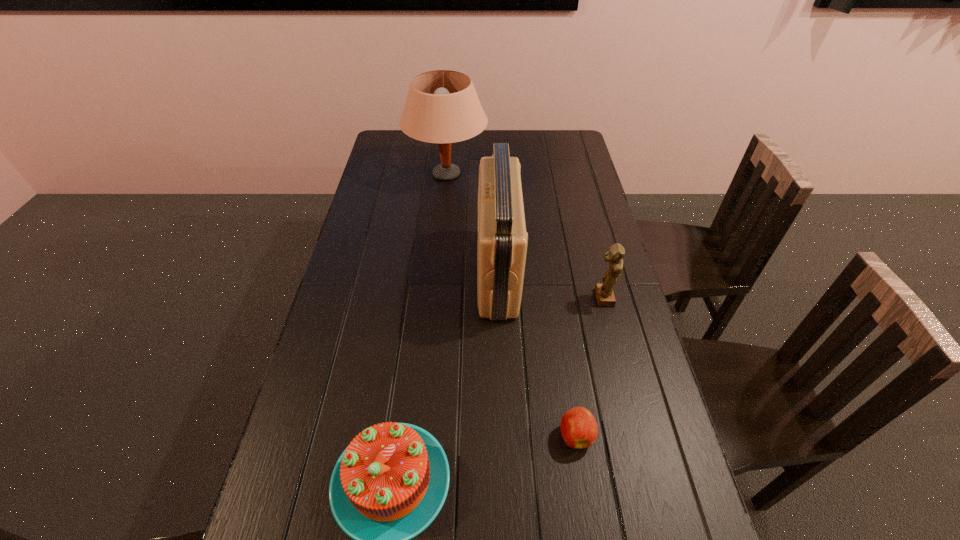
Where is `free space at the right edge of the desktop`? This screenshot has width=960, height=540. free space at the right edge of the desktop is located at coordinates (570, 181).

The image size is (960, 540). In the image, there is a desktop. In order to click on vacant space at the far right corner in this screenshot , I will do `click(552, 142)`.

At what (x,y) coordinates should I click in order to perform the action: click on vacant area that lies between the radio receiver and the figurine. Please return your answer as a coordinate pair (x, y). Image resolution: width=960 pixels, height=540 pixels. Looking at the image, I should click on (550, 286).

You are a GUI agent. You are given a task and a screenshot of the screen. Output one action in this format:
    pyautogui.click(x=<x>, y=<y>)
    Task: Click on the vacant point located between the shortest object and the figurine
    
    Given the screenshot: What is the action you would take?
    pyautogui.click(x=589, y=367)

Image resolution: width=960 pixels, height=540 pixels. What are the coordinates of `blank region between the fourth object from left to right and the rightmost object` in the screenshot? It's located at (589, 367).

Find the location of `object that stands as the third closest to the radio receiver`. object that stands as the third closest to the radio receiver is located at coordinates (579, 429).

Locate which object ranks third in proximity to the farthest object. Please provide its 2D coordinates. Your answer should be formatted as a tuple, i.e. [(x, y)], where the tuple contains the x and y coordinates of a point satisfying the conditions above.

[(389, 484)]

You are a GUI agent. You are given a task and a screenshot of the screen. Output one action in this format:
    pyautogui.click(x=<x>, y=<y>)
    Task: Click on the vacant area that satisfies the following two spatial constraints: 1. on the back side of the shortest object; 2. on the front-facing side of the lampshade
    The width and height of the screenshot is (960, 540).
    Given the screenshot: What is the action you would take?
    pyautogui.click(x=536, y=174)

At what (x,y) coordinates should I click in order to perform the action: click on vacant area that satisfies the following two spatial constraints: 1. on the front-facing side of the shortest object; 2. on the left side of the lampshade. Please return your answer as a coordinate pair (x, y). Looking at the image, I should click on (422, 435).